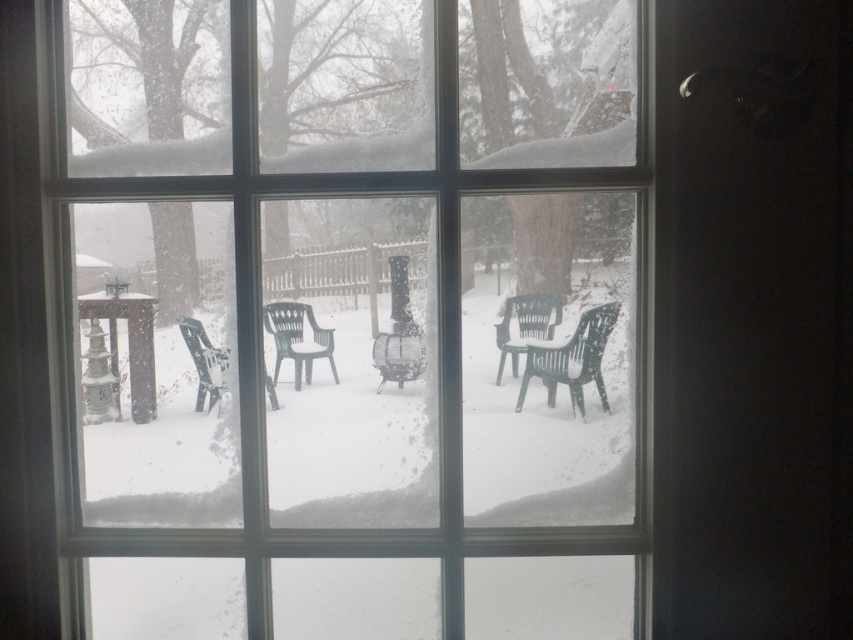
Question: Is translucent plastic chair at center smaller than green plastic chair at lower left?

Choices:
 (A) yes
 (B) no

Answer: (A)

Question: Which of the following is the closest to the observer?

Choices:
 (A) (537, 358)
 (B) (303, 387)

Answer: (B)

Question: Is translucent plastic chair at center wider than green plastic chair at lower left?

Choices:
 (A) no
 (B) yes

Answer: (A)

Question: Among these points, which one is farthest from the camera?

Choices:
 (A) (201, 324)
 (B) (323, 124)

Answer: (A)

Question: Which is farther from the green plastic chair at lower left?

Choices:
 (A) transparent glass window at center
 (B) green plastic chair at center-right

Answer: (B)

Question: Does green plastic chair at center-right appear on the right side of translucent plastic chair at center?

Choices:
 (A) yes
 (B) no

Answer: (A)